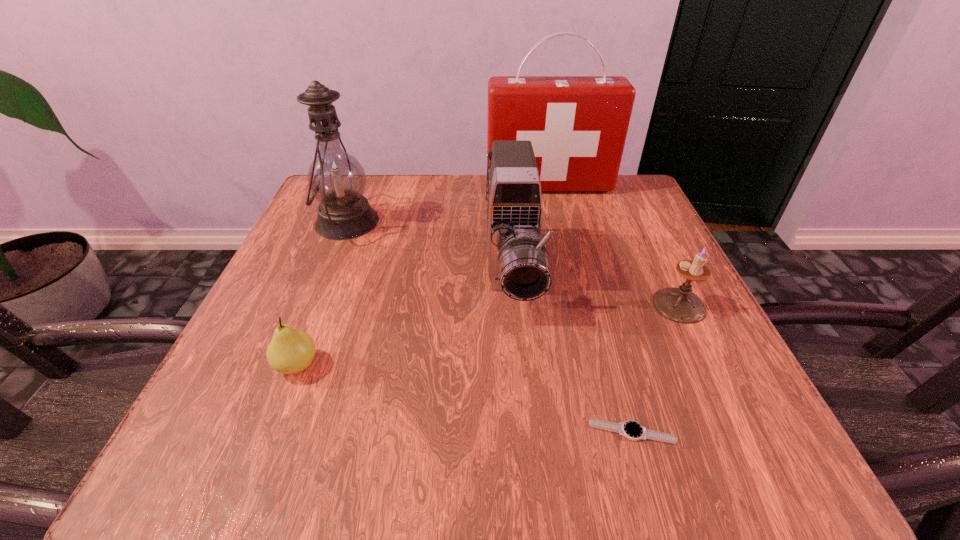
Find the location of a particular element. vacant position at the far right corner of the desktop is located at coordinates (627, 211).

The height and width of the screenshot is (540, 960). I want to click on vacant area at the near right corner of the desktop, so click(751, 467).

Where is `vacant area that lies between the fourth tallest object and the pear`? vacant area that lies between the fourth tallest object and the pear is located at coordinates (489, 335).

Where is `free point between the farthest object and the shortest object`? The image size is (960, 540). free point between the farthest object and the shortest object is located at coordinates (590, 309).

The width and height of the screenshot is (960, 540). Find the location of `blank region between the shortest object and the oil lamp`. blank region between the shortest object and the oil lamp is located at coordinates (490, 327).

Find the location of a particular element. The width and height of the screenshot is (960, 540). free area in between the watch and the fifth tallest object is located at coordinates (465, 399).

Identify the location of free space between the candle holder and the fourth shortest object. This screenshot has height=540, width=960. (595, 289).

This screenshot has height=540, width=960. I want to click on vacant area between the watch and the fifth tallest object, so click(465, 399).

Locate an element on the screen. Image resolution: width=960 pixels, height=540 pixels. empty location between the third tallest object and the third shortest object is located at coordinates (595, 289).

Find the location of `vacant area that lies between the fourth tallest object and the first-aid kit`. vacant area that lies between the fourth tallest object and the first-aid kit is located at coordinates (614, 245).